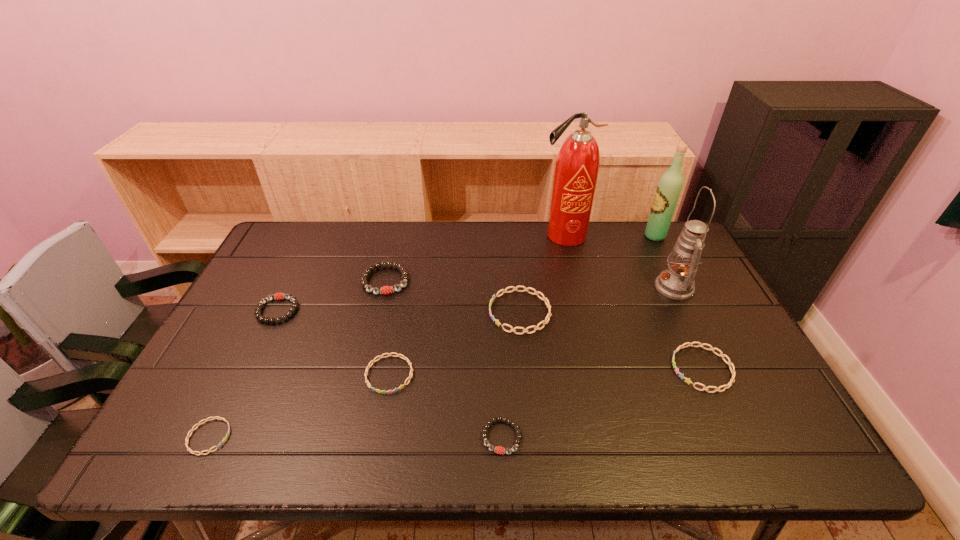
The image size is (960, 540). Identify the location of vacant area between the shortest object and the smallest black bracelet. (355, 437).

Choose which object is the nearest neighbor to the third blue bracelet from left to right. Please provide its 2D coordinates. Your answer should be formatted as a tuple, i.e. [(x, y)], where the tuple contains the x and y coordinates of a point satisfying the conditions above.

[(389, 354)]

Identify which object is located as the eighth nearest to the oil lamp. Please provide its 2D coordinates. Your answer should be formatted as a tuple, i.e. [(x, y)], where the tuple contains the x and y coordinates of a point satisfying the conditions above.

[(278, 296)]

The width and height of the screenshot is (960, 540). Find the location of `bracelet that can be found as the sixth closest to the leftmost black bracelet`. bracelet that can be found as the sixth closest to the leftmost black bracelet is located at coordinates (722, 355).

You are a GUI agent. You are given a task and a screenshot of the screen. Output one action in this format:
    pyautogui.click(x=<x>, y=<y>)
    Task: Click on the second closest bracelet to the nearest black bracelet
    
    Given the screenshot: What is the action you would take?
    pyautogui.click(x=544, y=298)

Where is `the fourth closest blue bracelet to the biggest black bracelet`? The height and width of the screenshot is (540, 960). the fourth closest blue bracelet to the biggest black bracelet is located at coordinates (722, 355).

Select which blue bracelet appears as the third closest to the farthest blue bracelet. Please provide its 2D coordinates. Your answer should be formatted as a tuple, i.e. [(x, y)], where the tuple contains the x and y coordinates of a point satisfying the conditions above.

[(218, 418)]

I want to click on black bracelet that is the second closest to the second black bracelet from right to left, so click(x=499, y=450).

Choose which black bracelet is the second nearest neighbor to the nearest black bracelet. Please provide its 2D coordinates. Your answer should be formatted as a tuple, i.e. [(x, y)], where the tuple contains the x and y coordinates of a point satisfying the conditions above.

[(278, 296)]

Find the location of `free spot that satisfies the following two spatial constraints: 1. on the surface of the rightmost bracelet showing star-shaped elements; 2. on the front side of the rightmost black bracelet`. free spot that satisfies the following two spatial constraints: 1. on the surface of the rightmost bracelet showing star-shaped elements; 2. on the front side of the rightmost black bracelet is located at coordinates pos(733,437).